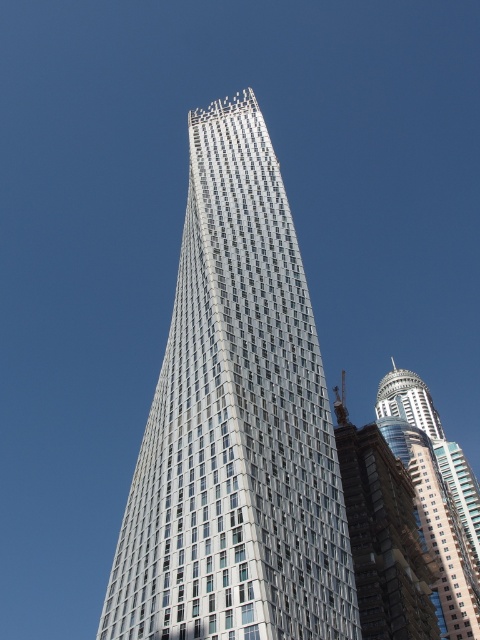
Question: Does metallic glass tower at center have a greater width compared to shiny glass skyscraper at right?

Choices:
 (A) yes
 (B) no

Answer: (B)

Question: Is metallic glass tower at center above shiny glass skyscraper at right?

Choices:
 (A) no
 (B) yes

Answer: (B)

Question: Which point is closer to the camera taking this photo?

Choices:
 (A) (396, 372)
 (B) (309, 614)

Answer: (B)

Question: Can you confirm if metallic glass tower at center is bigger than shiny glass skyscraper at right?

Choices:
 (A) no
 (B) yes

Answer: (B)

Question: Among these points, which one is nearest to the camera?

Choices:
 (A) (204, 513)
 (B) (435, 522)

Answer: (A)

Question: Which object appears farthest from the camera in this image?

Choices:
 (A) shiny glass skyscraper at right
 (B) metallic glass tower at center

Answer: (A)